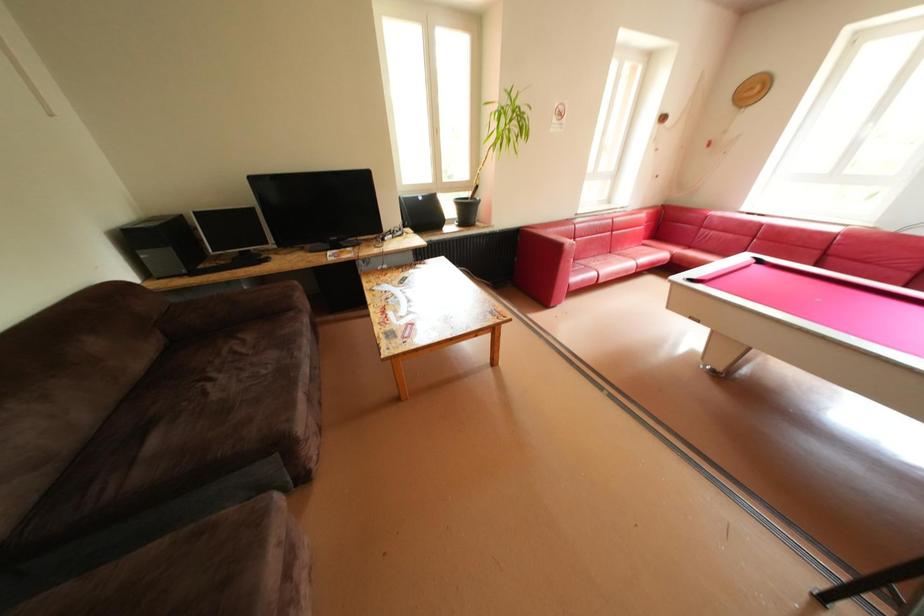
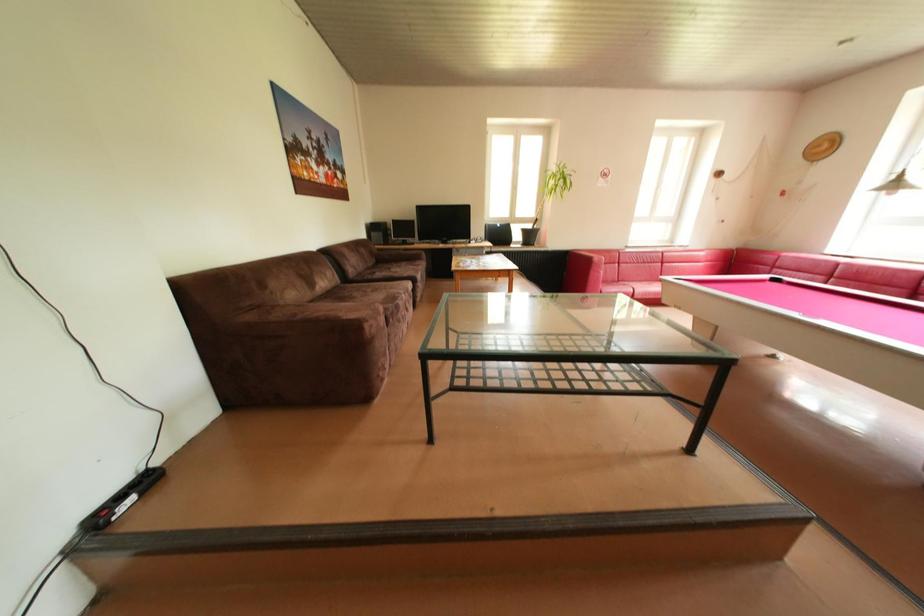
What movement of the cameraman would produce the second image?

The movement direction of the cameraman is right, backward.